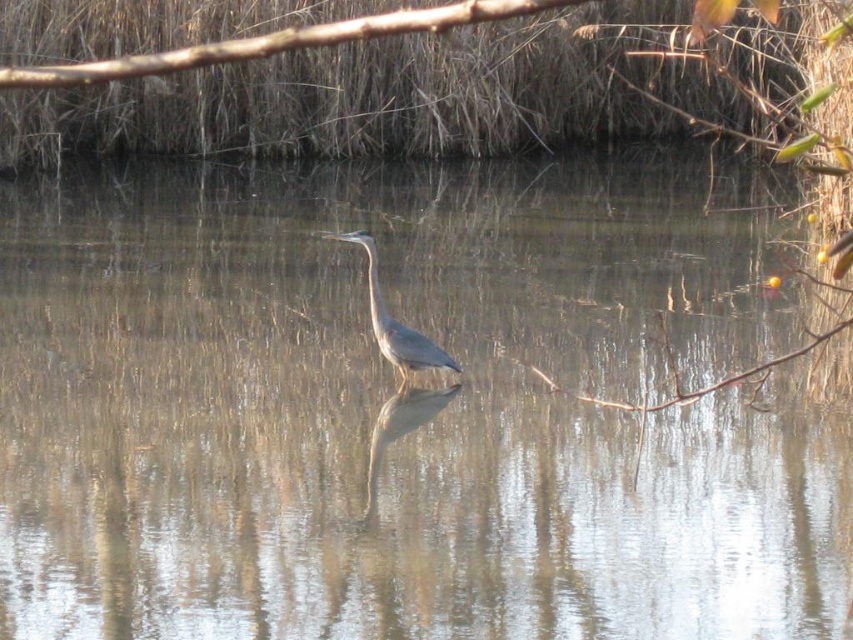
You are a photographer trying to capture the gray matte bird at center in your shot. There is a brown rough branch at upper center in the way. Can you adjust your camera angle to avoid the branch while still keeping the bird in the frame?

The brown rough branch at upper center is in front of the gray matte bird at center, so adjusting the camera angle downward might allow you to capture the bird without the branch obstructing it.

You are a wildlife photographer observing the scene. You notice the gray matte bird at center and the blue glossy heron at center. Which bird is positioned higher in the image?

The gray matte bird at center is positioned higher than the blue glossy heron at center in the image.

You are a photographer trying to capture the gray matte bird at center and the brown rough branch at upper center in the same frame. Based on their positions, can you determine which object is higher in the image?

The brown rough branch at upper center is above the gray matte bird at center, so it is higher in the image.